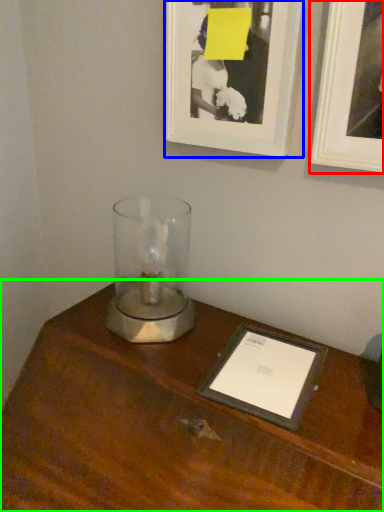
Question: Based on their relative distances, which object is nearer to picture frame (highlighted by a red box)? Choose from picture frame (highlighted by a blue box) and table (highlighted by a green box).

Choices:
 (A) picture frame
 (B) table

Answer: (A)